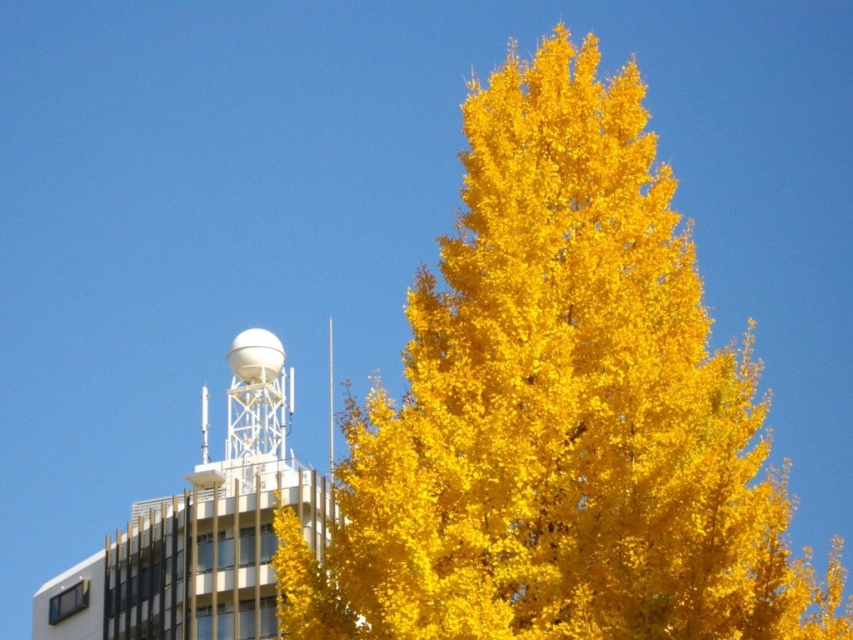
What are the coordinates of the white metallic tower at upper left in the image?

The white metallic tower at upper left is located at coordinates point (202, 529).

You are standing at the base of the white metallic tower at upper left and want to walk to the vibrant yellow tree on the right. If your walking speed is 1.5 meters per second, how long will it take you to reach the tree?

The distance of white metallic tower at upper left from viewer is 69.02 meters. Since you are at the base of the tower, the distance to the tree would be approximately 69.02 meters. At a walking speed of 1.5 meters per second, it would take about 46 seconds to reach the tree.